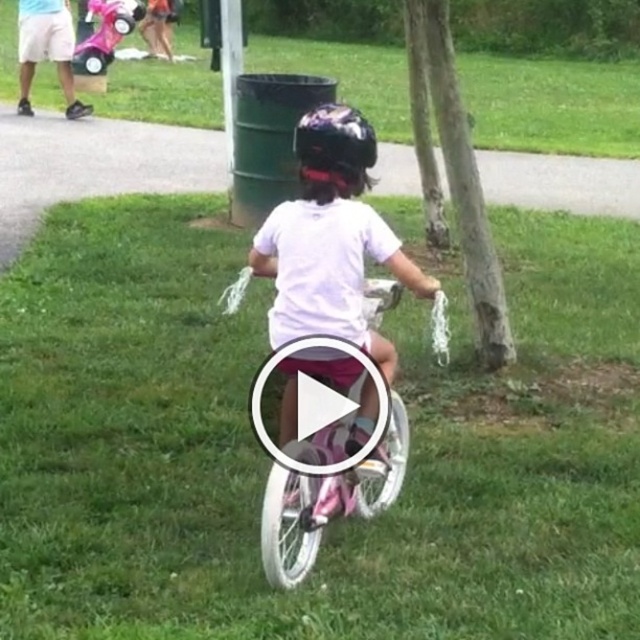
Does shiny purple helmet at center have a greater height compared to pink plastic tricycle at upper left?

Incorrect, shiny purple helmet at center's height is not larger of pink plastic tricycle at upper left's.

Is shiny purple helmet at center wider than pink plastic tricycle at upper left?

No.

Is point (324, 157) more distant than point (92, 51)?

That is False.

Where is `shiny purple helmet at center`? shiny purple helmet at center is located at coordinates (336, 147).

Looking at this image, is green grass at center positioned behind brown rough tree at center?

That is False.

I want to click on green grass at center, so click(266, 460).

Image resolution: width=640 pixels, height=640 pixels. What do you see at coordinates (266, 460) in the screenshot? I see `green grass at center` at bounding box center [266, 460].

You are a GUI agent. You are given a task and a screenshot of the screen. Output one action in this format:
    pyautogui.click(x=<x>, y=<y>)
    Task: Click on the green grass at center
    This screenshot has width=640, height=640.
    Given the screenshot: What is the action you would take?
    pyautogui.click(x=266, y=460)

Does green grass at center have a greater width compared to pink plastic tricycle at upper left?

Yes, green grass at center is wider than pink plastic tricycle at upper left.

You are a GUI agent. You are given a task and a screenshot of the screen. Output one action in this format:
    pyautogui.click(x=<x>, y=<y>)
    Task: Click on the green grass at center
    The image size is (640, 640).
    Given the screenshot: What is the action you would take?
    pos(266,460)